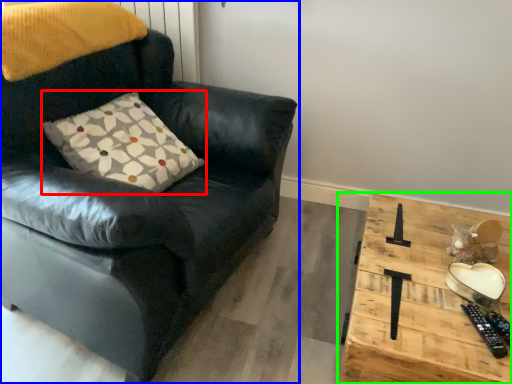
Question: Based on their relative distances, which object is nearer to pillow (highlighted by a red box)? Choose from chair (highlighted by a blue box) and table (highlighted by a green box).

Choices:
 (A) chair
 (B) table

Answer: (A)